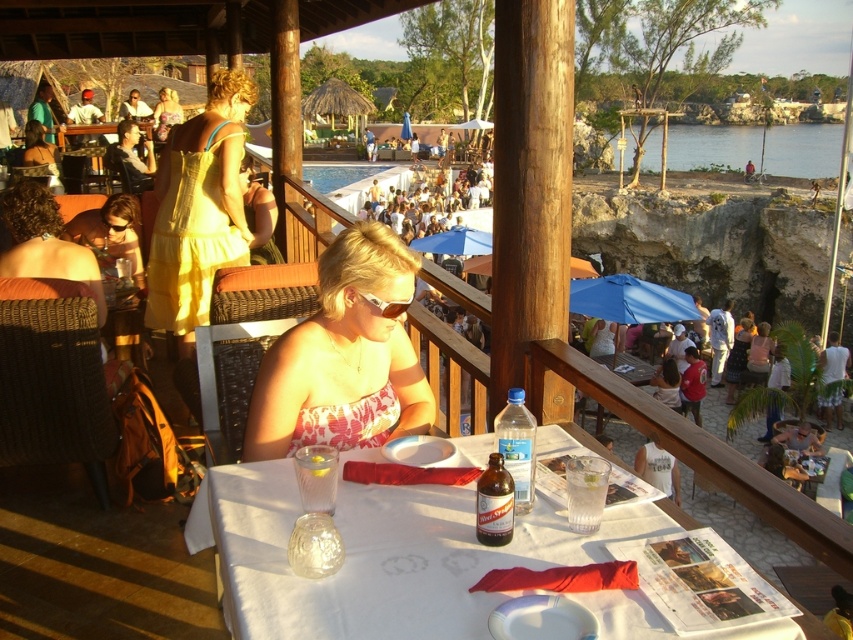
Is yellow cotton dress at upper left wider than blue water at lower right?

In fact, yellow cotton dress at upper left might be narrower than blue water at lower right.

Between yellow cotton dress at upper left and blue water at lower right, which one has more height?

With more height is blue water at lower right.

The width and height of the screenshot is (853, 640). In order to click on yellow cotton dress at upper left in this screenshot , I will do 198,209.

Does pink strapless dress at center come behind yellow cotton dress at upper left?

That is False.

Does pink strapless dress at center come in front of yellow cotton dress at upper left?

Yes, pink strapless dress at center is closer to the viewer.

At what (x,y) coordinates should I click in order to perform the action: click on pink strapless dress at center. Please return your answer as a coordinate pair (x, y). Looking at the image, I should click on (344, 356).

Is blue water at lower right closer to the viewer compared to blue fabric umbrella at center?

No, it is behind blue fabric umbrella at center.

Can you confirm if blue water at lower right is wider than blue fabric umbrella at center?

Yes, blue water at lower right is wider than blue fabric umbrella at center.

At what (x,y) coordinates should I click in order to perform the action: click on blue water at lower right. Please return your answer as a coordinate pair (x, y). The width and height of the screenshot is (853, 640). Looking at the image, I should click on (712, 147).

I want to click on blue water at lower right, so click(x=712, y=147).